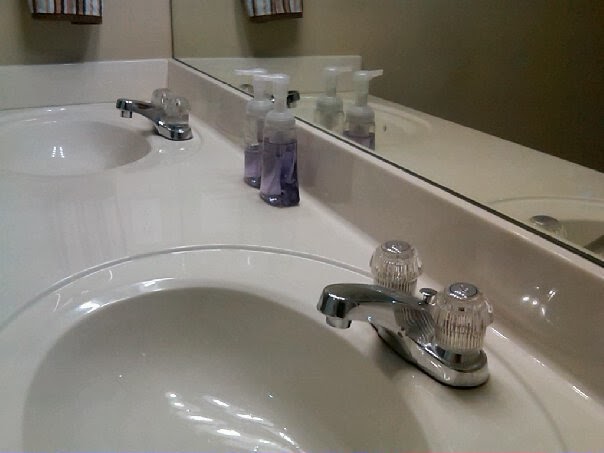
I want to click on sink, so pyautogui.click(x=68, y=156), pyautogui.click(x=209, y=389).